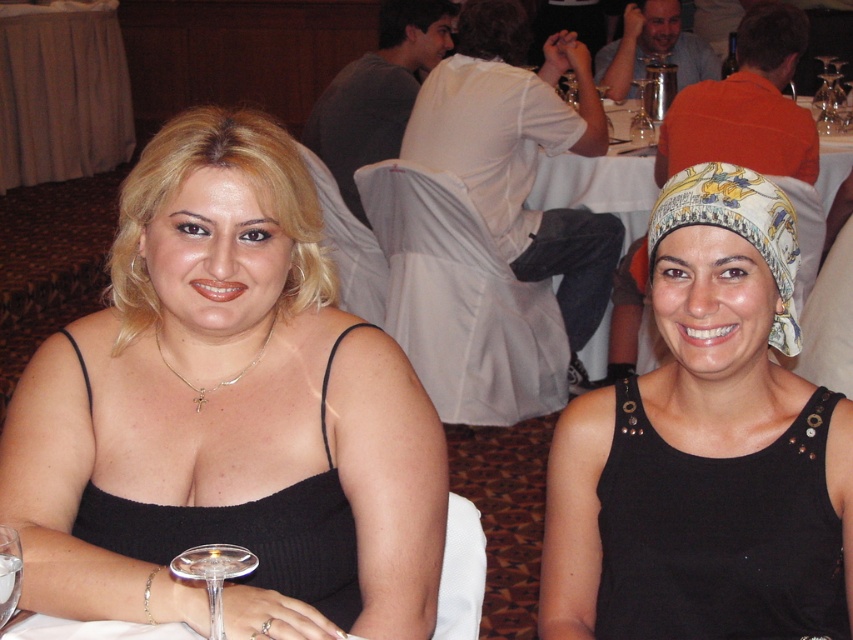
Question: Where is white cloth table at center located in relation to transparent glass at upper center in the image?

Choices:
 (A) above
 (B) below

Answer: (B)

Question: Estimate the real-world distances between objects in this image. Which object is closer to the white cloth table at center?

Choices:
 (A) transparent glass wine glass at lower left
 (B) transparent glass at upper center

Answer: (B)

Question: Among these points, which one is nearest to the camera?

Choices:
 (A) (647, 131)
 (B) (581, 177)

Answer: (B)

Question: Which of the following is the closest to the observer?

Choices:
 (A) transparent glass wine glass at lower left
 (B) white cloth table at center
 (C) transparent glass at lower left

Answer: (C)

Question: Can you confirm if printed silk headscarf at center is positioned below transparent glass wine glass at lower left?

Choices:
 (A) yes
 (B) no

Answer: (B)

Question: Considering the relative positions of white satin tablecloth at upper left and transparent glass at lower left in the image provided, where is white satin tablecloth at upper left located with respect to transparent glass at lower left?

Choices:
 (A) above
 (B) below

Answer: (A)